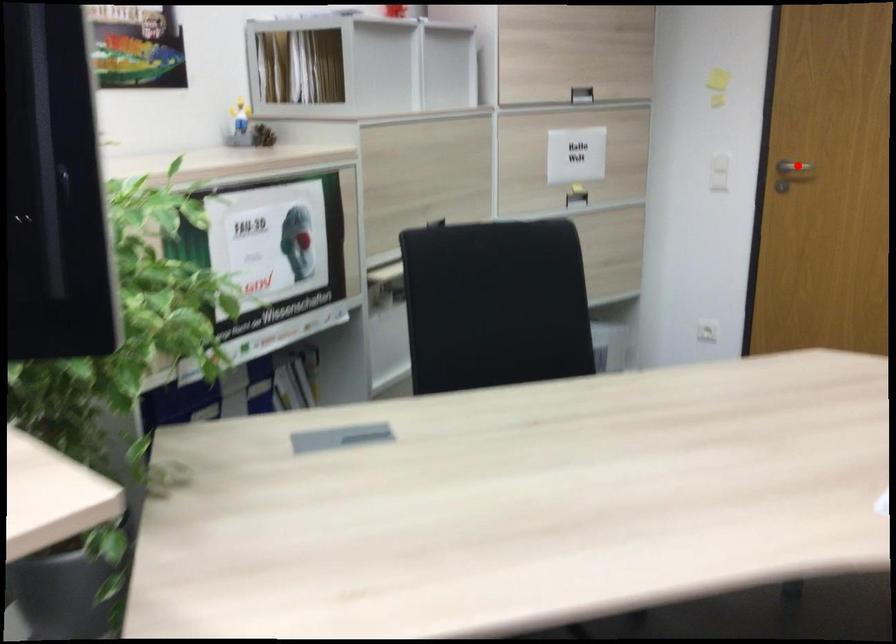
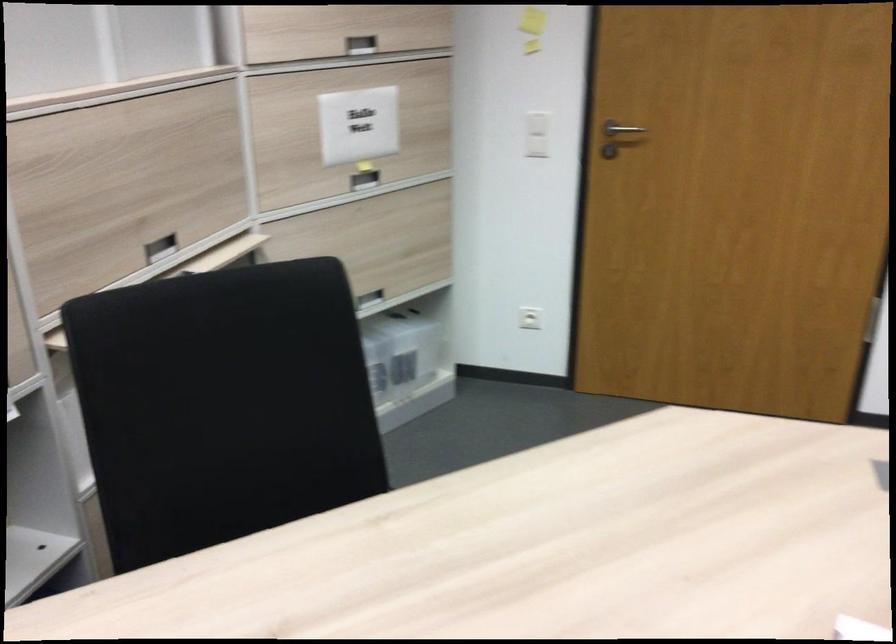
The point at the highlighted location is marked in the first image. Where is the corresponding point in the second image?

(619, 129)